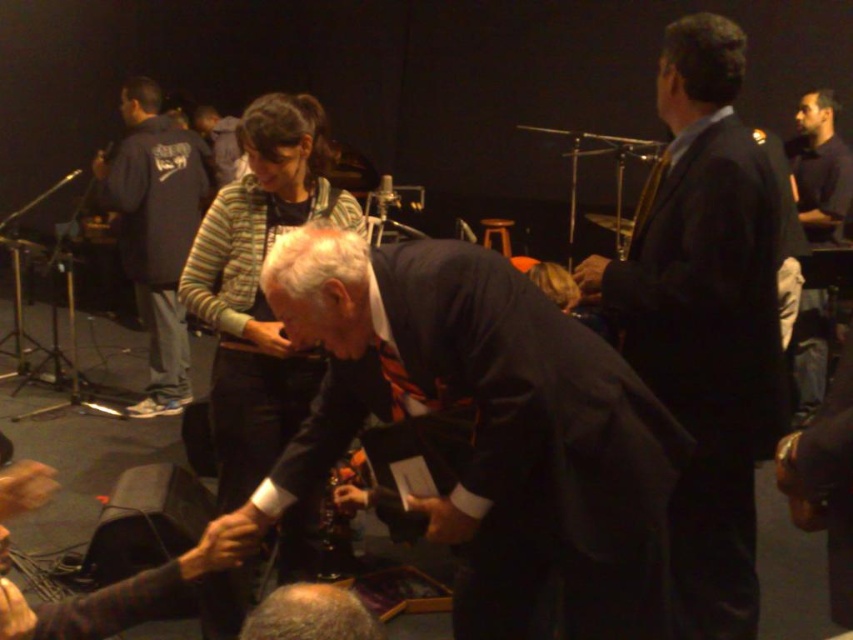
Can you confirm if dark suit at center is shorter than dark gray suit at upper center?

Incorrect, dark suit at center's height does not fall short of dark gray suit at upper center's.

The height and width of the screenshot is (640, 853). I want to click on dark suit at center, so click(705, 317).

From the picture: Which is more to the right, striped sweater at center or dark gray suit at upper center?

Positioned to the right is striped sweater at center.

Is striped sweater at center smaller than dark gray suit at upper center?

Indeed, striped sweater at center has a smaller size compared to dark gray suit at upper center.

Which is behind, point (225, 593) or point (216, 154)?

Positioned behind is point (216, 154).

At what (x,y) coordinates should I click in order to perform the action: click on striped sweater at center. Please return your answer as a coordinate pair (x, y). The image size is (853, 640). Looking at the image, I should click on (259, 289).

Which is below, dark blue suit at center or dark blue jacket at left?

dark blue suit at center is lower down.

Between dark blue suit at center and dark blue jacket at left, which one is positioned higher?

dark blue jacket at left is higher up.

Between point (260, 483) and point (164, 125), which one is positioned behind?

The point (164, 125) is behind.

Image resolution: width=853 pixels, height=640 pixels. Find the location of `dark blue suit at center`. dark blue suit at center is located at coordinates (486, 426).